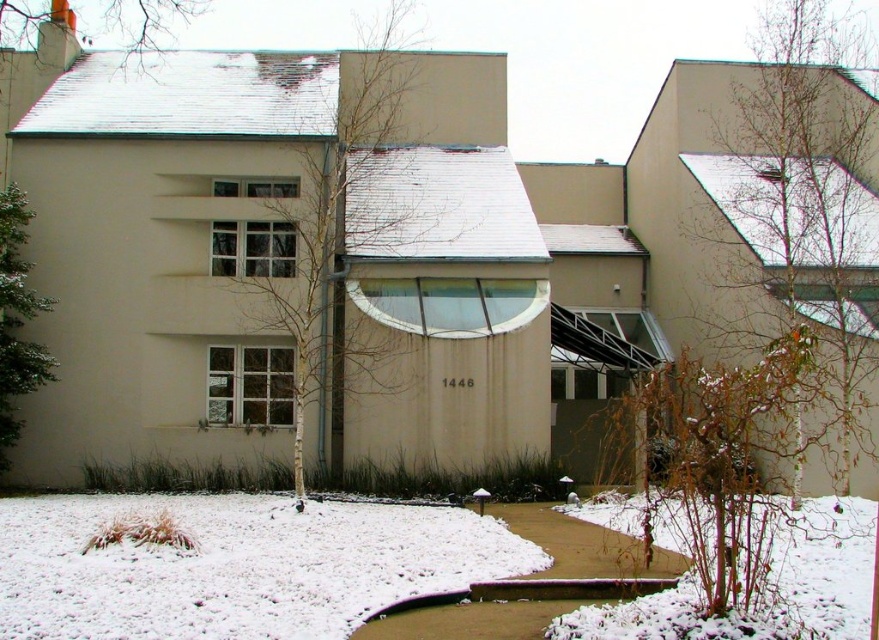
Question: Observing the image, what is the correct spatial positioning of bare branches at right in reference to green textured evergreen tree at left?

Choices:
 (A) below
 (B) above

Answer: (B)

Question: Which of these objects is positioned closest to the green textured evergreen tree at left?

Choices:
 (A) white powdery snow at lower center
 (B) white snow-covered tree at upper left
 (C) bare branches at center
 (D) bare branches at right

Answer: (A)

Question: Estimate the real-world distances between objects in this image. Which object is closer to the bare branches at center?

Choices:
 (A) green textured evergreen tree at left
 (B) white powdery snow at lower center

Answer: (B)

Question: Which point is closer to the camera taking this photo?

Choices:
 (A) (129, 577)
 (B) (259, 316)

Answer: (A)

Question: Is bare branches at right wider than bare branches at center?

Choices:
 (A) no
 (B) yes

Answer: (B)

Question: Is bare branches at center above white snow-covered tree at upper left?

Choices:
 (A) no
 (B) yes

Answer: (A)